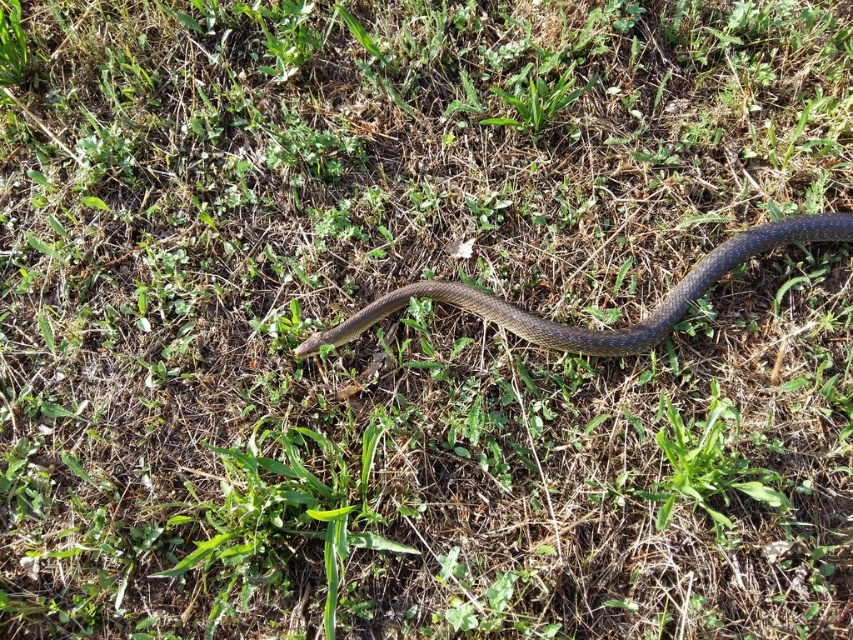
Question: Is shiny black snake at center above green leafy weed at upper center?

Choices:
 (A) no
 (B) yes

Answer: (A)

Question: Is shiny black snake at center below green leafy weed at upper center?

Choices:
 (A) yes
 (B) no

Answer: (A)

Question: Among these points, which one is nearest to the camera?

Choices:
 (A) (578, 90)
 (B) (471, 305)

Answer: (B)

Question: Is the position of shiny black snake at center more distant than that of green leafy weed at upper center?

Choices:
 (A) no
 (B) yes

Answer: (A)

Question: Which object appears farthest from the camera in this image?

Choices:
 (A) green leafy weed at upper center
 (B) shiny black snake at center

Answer: (A)

Question: Which point appears farthest from the camera in this image?

Choices:
 (A) (526, 125)
 (B) (457, 288)

Answer: (A)